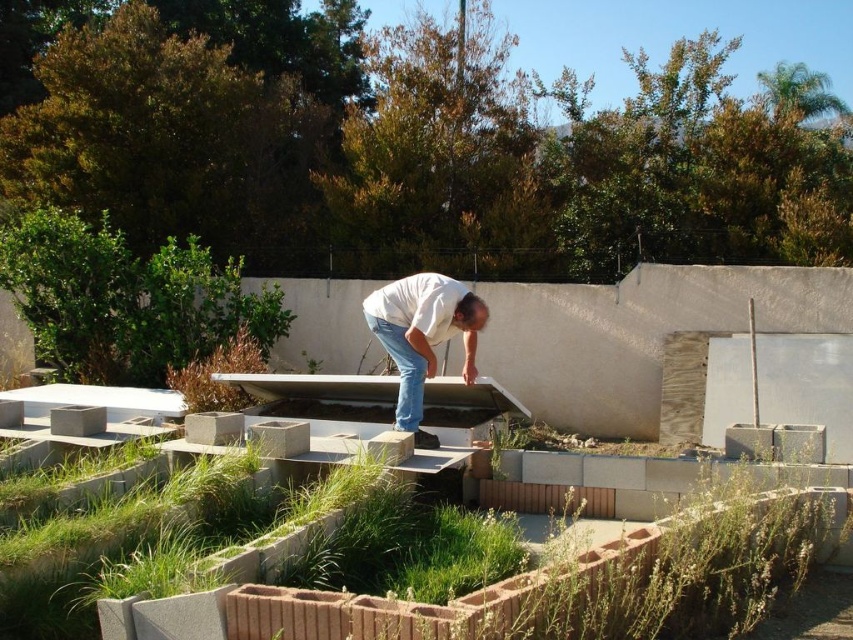
You are a fashion designer observing a construction worker in the scene. Which clothing item, the white matte shirt at center or the jeans at center, has a greater width?

The white matte shirt at center has a greater width than the jeans at center according to the description provided.